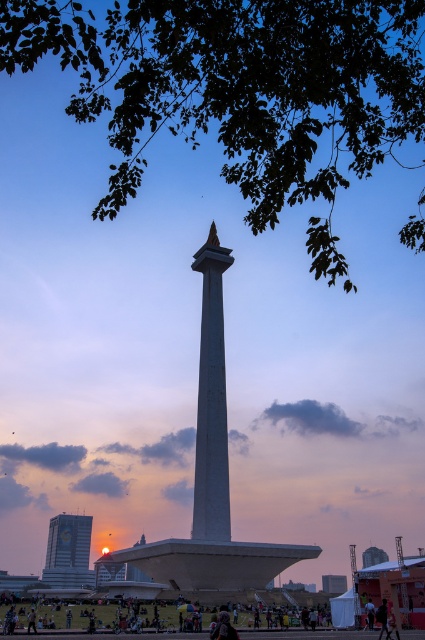
You are a photographer aiming to capture the National Monument with both the matte glass building at lower left and the dark clothing at lower center in the frame. Based on their positions, which object should you adjust your camera angle to include first?

The matte glass building at lower left is below dark clothing at lower center, so you should adjust your camera angle to include the matte glass building at lower left first as it is lower in the frame.

You are planning to take a photo of the white concrete tower at center and the green leafy tree at upper center from a distance. Which object will appear wider in the photo?

The green leafy tree at upper center will appear wider in the photo because its width is larger than the white concrete tower at center.

You are standing in the grassy area near the National Monument in Jakarta. You want to take a photo of the monument with the green leafy tree at upper center in the background. If your camera can focus on objects up to 30 meters away, will you be able to capture both the monument and the tree clearly in one shot?

The green leafy tree at upper center is 29.22 meters away from the viewer. Since your camera can focus up to 30 meters, you can capture both the monument and the tree clearly in one shot as the distance is within the camera range.